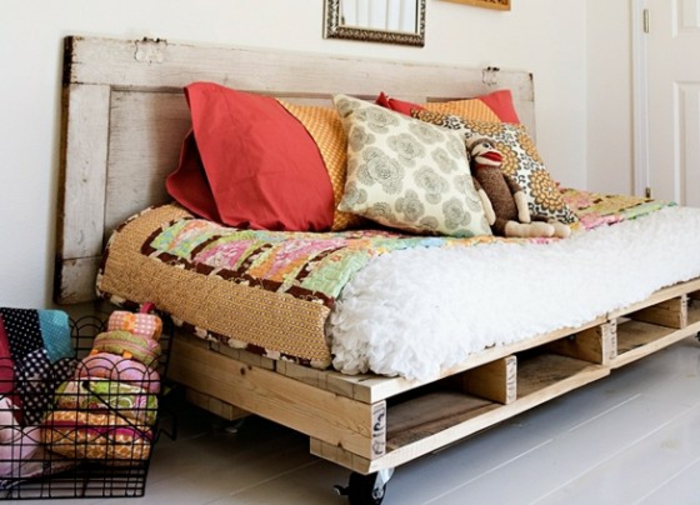
You are a GUI agent. You are given a task and a screenshot of the screen. Output one action in this format:
    pyautogui.click(x=<x>, y=<y>)
    Task: Click on the door frame
    The image size is (700, 505).
    Given the screenshot: What is the action you would take?
    pyautogui.click(x=634, y=85)